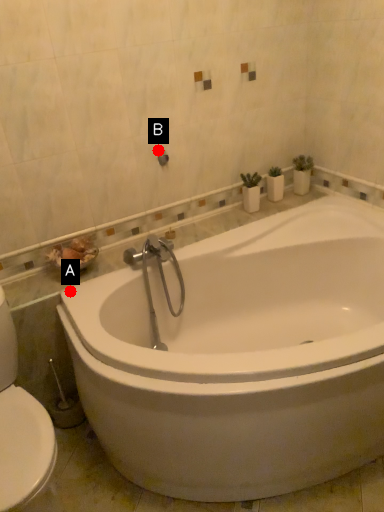
Question: Two points are circled on the image, labeled by A and B beside each circle. Which point is further to the camera?

Choices:
 (A) A is further
 (B) B is further

Answer: (B)